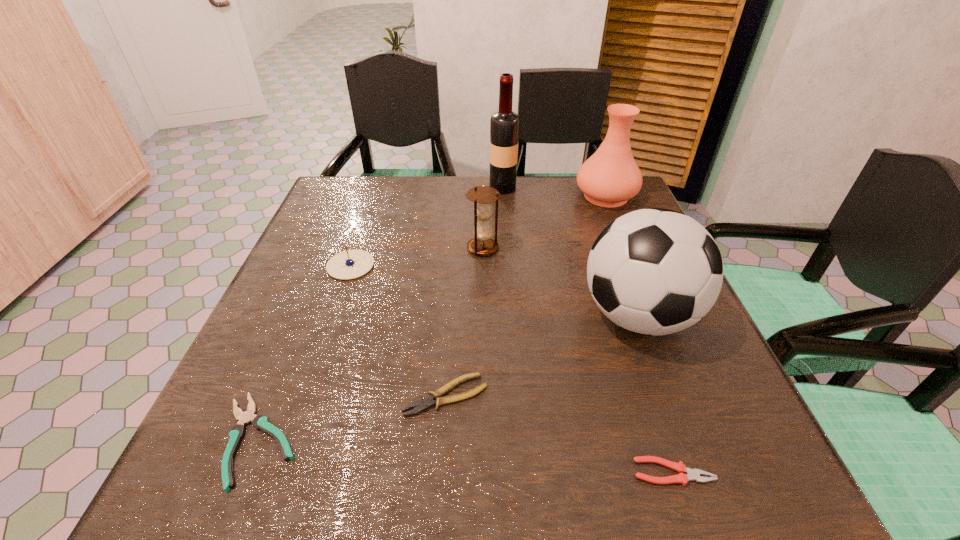
Find the location of a particular element. Image resolution: width=960 pixels, height=540 pixels. vase situated at the right edge is located at coordinates (610, 177).

This screenshot has height=540, width=960. What are the coordinates of `soccer ball present at the right edge` in the screenshot? It's located at (654, 271).

The height and width of the screenshot is (540, 960). What are the coordinates of `pliers present at the right edge` in the screenshot? It's located at (x=694, y=474).

Where is `object positioned at the near left corner`? Image resolution: width=960 pixels, height=540 pixels. object positioned at the near left corner is located at coordinates (260, 422).

You are a GUI agent. You are given a task and a screenshot of the screen. Output one action in this format:
    pyautogui.click(x=<x>, y=<y>)
    Task: Click on the object present at the far right corner
    This screenshot has height=540, width=960.
    Given the screenshot: What is the action you would take?
    pyautogui.click(x=610, y=177)

Image resolution: width=960 pixels, height=540 pixels. I want to click on object positioned at the near right corner, so click(x=694, y=474).

In the image, there is a desktop. Find the location of `vacant space at the far edge`. vacant space at the far edge is located at coordinates (512, 195).

The height and width of the screenshot is (540, 960). Identify the location of free space at the near edge of the desktop. (575, 468).

Find the location of a particular element. free region at the left edge of the desktop is located at coordinates (306, 261).

This screenshot has height=540, width=960. In the image, there is a desktop. Identify the location of free space at the right edge. (637, 335).